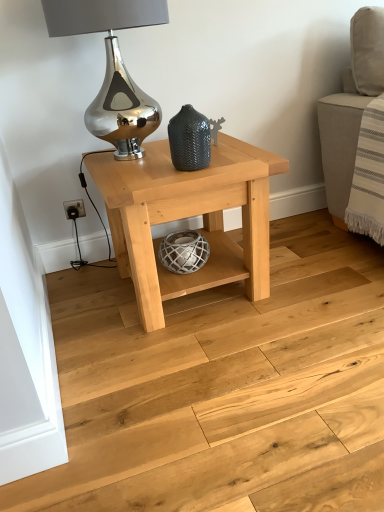
Find the location of a particular element. unoccupied area in front of natural wood table at center is located at coordinates (205, 373).